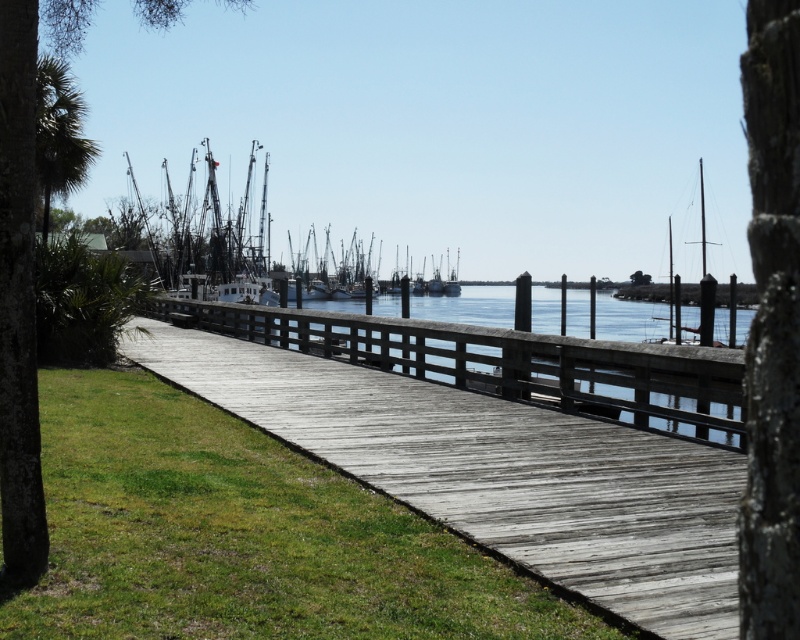
Is green leafy palm tree at upper left above smooth white sailboat at right?

Incorrect, green leafy palm tree at upper left is not positioned above smooth white sailboat at right.

Between point (90, 138) and point (704, 285), which one is positioned behind?

Positioned behind is point (90, 138).

The width and height of the screenshot is (800, 640). What do you see at coordinates (60, 132) in the screenshot? I see `green leafy palm tree at upper left` at bounding box center [60, 132].

I want to click on green leafy palm tree at upper left, so click(x=60, y=132).

Between green grass at lower left and white matte boat at center, which one appears on the left side from the viewer's perspective?

white matte boat at center is more to the left.

At what (x,y) coordinates should I click in order to perform the action: click on green grass at lower left. Please return your answer as a coordinate pair (x, y). This screenshot has width=800, height=640. Looking at the image, I should click on (241, 536).

Is point (120, 632) closer to camera compared to point (188, 284)?

Yes.

Locate an element on the screen. The image size is (800, 640). green grass at lower left is located at coordinates (241, 536).

Between white matte boat at center and smooth white sailboat at right, which one appears on the left side from the viewer's perspective?

white matte boat at center is more to the left.

What do you see at coordinates (280, 264) in the screenshot? I see `white matte boat at center` at bounding box center [280, 264].

Locate an element on the screen. white matte boat at center is located at coordinates (280, 264).